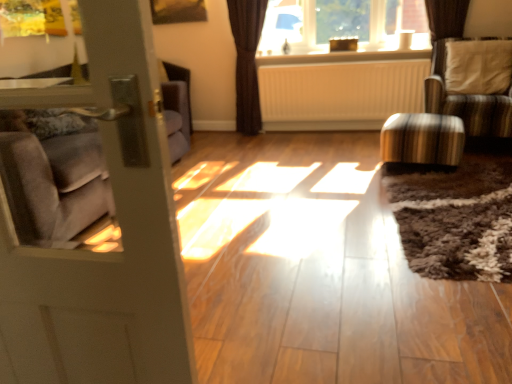
Question: Can you confirm if white textured pillow at upper right is shorter than striped fabric chair at right?

Choices:
 (A) yes
 (B) no

Answer: (A)

Question: From a real-world perspective, is white textured pillow at upper right beneath striped fabric chair at right?

Choices:
 (A) yes
 (B) no

Answer: (B)

Question: Does white textured pillow at upper right come in front of striped fabric chair at right?

Choices:
 (A) no
 (B) yes

Answer: (A)

Question: Is white textured pillow at upper right facing towards striped fabric chair at right?

Choices:
 (A) no
 (B) yes

Answer: (B)

Question: Does white textured pillow at upper right have a greater height compared to striped fabric chair at right?

Choices:
 (A) yes
 (B) no

Answer: (B)

Question: Looking at their shapes, would you say striped fabric chair at right is wider or thinner than metallic striped stool at right?

Choices:
 (A) thin
 (B) wide

Answer: (B)

Question: Does point (502, 102) appear closer or farther from the camera than point (435, 135)?

Choices:
 (A) closer
 (B) farther

Answer: (B)

Question: From the image's perspective, is striped fabric chair at right located above or below metallic striped stool at right?

Choices:
 (A) below
 (B) above

Answer: (B)

Question: Is striped fabric chair at right spatially inside metallic striped stool at right, or outside of it?

Choices:
 (A) outside
 (B) inside

Answer: (A)

Question: Looking at the image, does clear glass window at upper center seem bigger or smaller compared to brown textured curtain at upper center?

Choices:
 (A) big
 (B) small

Answer: (A)

Question: From a real-world perspective, is clear glass window at upper center physically located above or below brown textured curtain at upper center?

Choices:
 (A) above
 (B) below

Answer: (A)

Question: In terms of width, does clear glass window at upper center look wider or thinner when compared to brown textured curtain at upper center?

Choices:
 (A) wide
 (B) thin

Answer: (A)

Question: From the image's perspective, is clear glass window at upper center located above or below brown textured curtain at upper center?

Choices:
 (A) below
 (B) above

Answer: (B)

Question: Is clear glass window at upper center taller or shorter than white matte radiator at center?

Choices:
 (A) short
 (B) tall

Answer: (A)

Question: From the image's perspective, is clear glass window at upper center positioned above or below white matte radiator at center?

Choices:
 (A) below
 (B) above

Answer: (B)